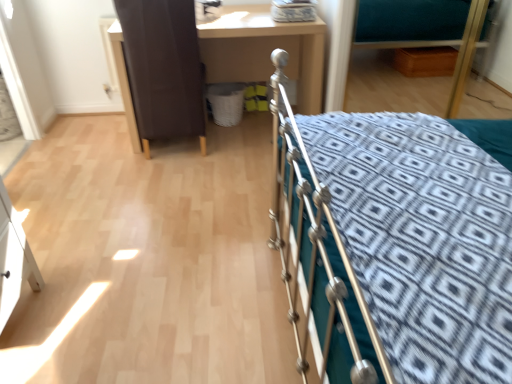
Locate an element on the screen. This screenshot has height=384, width=512. free space in front of brown leather screen door at upper left is located at coordinates (166, 176).